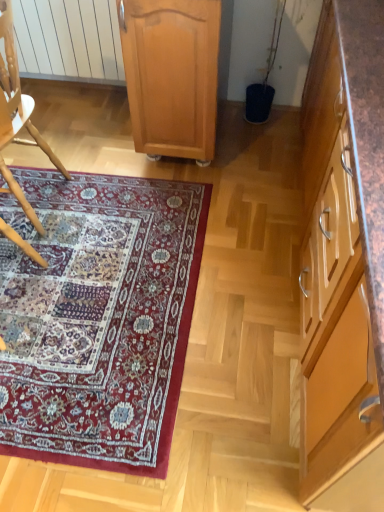
Find the location of a particular element. Image resolution: width=384 pixels, height=512 pixels. vacant space to the right of light brown wood cabinet at center, which is the first cabinetry from left to right is located at coordinates (257, 146).